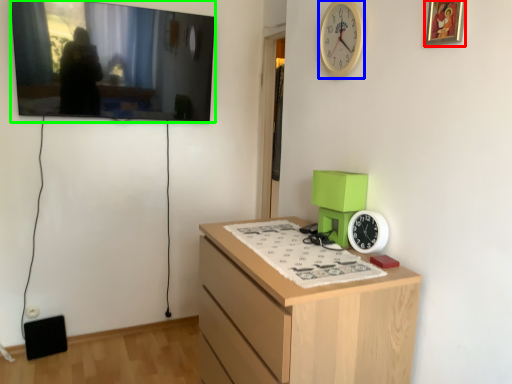
Question: Considering the real-world distances, which object is farthest from picture frame (highlighted by a red box)? clock (highlighted by a blue box) or picture frame (highlighted by a green box)?

Choices:
 (A) clock
 (B) picture frame

Answer: (B)